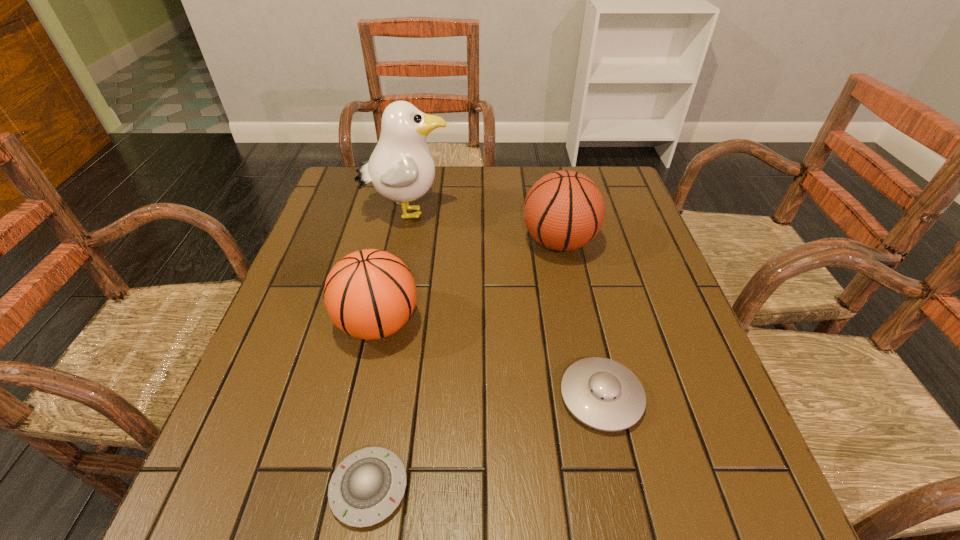
In order to click on free space located 0.320m on the side where the inflation valve is located in this screenshot , I will do `click(398, 242)`.

The image size is (960, 540). What are the coordinates of `free space located on the side where the inflation valve is located` in the screenshot? It's located at (406, 242).

Identify the location of vacant space located 0.120m on the back of the third farthest object. The width and height of the screenshot is (960, 540). (392, 258).

The width and height of the screenshot is (960, 540). I want to click on vacant space located on the back of the taller saucer, so click(566, 241).

Where is `vacant space located on the right of the shorter saucer`? vacant space located on the right of the shorter saucer is located at coordinates (626, 488).

Locate an element on the screen. The image size is (960, 540). object positioned at the far edge is located at coordinates coord(401,168).

The image size is (960, 540). In order to click on object that is at the near edge in this screenshot , I will do `click(372, 481)`.

Image resolution: width=960 pixels, height=540 pixels. I want to click on gull present at the left edge, so click(401, 168).

You are a GUI agent. You are given a task and a screenshot of the screen. Output one action in this format:
    pyautogui.click(x=<x>, y=<y>)
    Task: Click on the basketball located at the left edge
    This screenshot has height=540, width=960.
    Given the screenshot: What is the action you would take?
    pyautogui.click(x=369, y=294)

Find the location of a particular element. This screenshot has height=540, width=960. basketball that is positioned at the right edge is located at coordinates (564, 210).